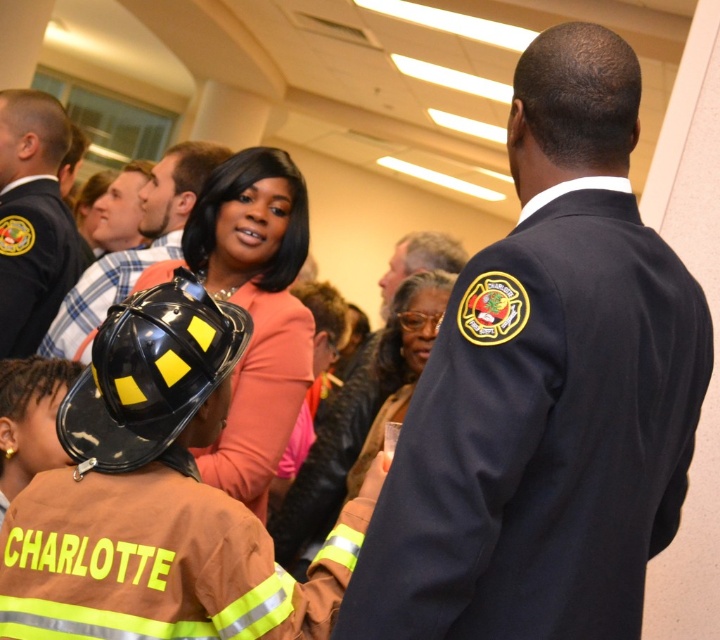
You are organizing a safety workshop and need to choose a helmet for a demonstration. The black matte helmet at lower left and the black matte helmet at center are available. Which one is larger?

The black matte helmet at center is larger than the black matte helmet at lower left.